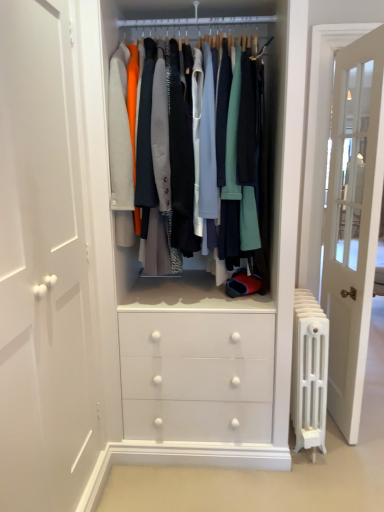
At what (x,y) coordinates should I click in order to perform the action: click on matte white clothes at center. Please return your answer as a coordinate pair (x, y). The height and width of the screenshot is (512, 384). Looking at the image, I should click on (203, 152).

This screenshot has height=512, width=384. Find the location of `white metal radiator at right`. white metal radiator at right is located at coordinates (309, 372).

Is white glass door at right spatially inside white metal radiator at right, or outside of it?

white glass door at right lies outside white metal radiator at right.

Looking at this image, is white glass door at right not near white metal radiator at right?

They are positioned close to each other.

Is white glass door at right wider or thinner than white metal radiator at right?

In the image, white glass door at right appears to be more narrow than white metal radiator at right.

Which is in front, point (257, 243) or point (344, 73)?

The point (257, 243) is in front.

Can you confirm if matte white clothes at center is positioned to the right of white glass door at right?

No, matte white clothes at center is not to the right of white glass door at right.

Which object is further away from the camera, matte white clothes at center or white glass door at right?

Positioned behind is white glass door at right.

Is matte white clothes at center looking in the opposite direction of white glass door at right?

matte white clothes at center does not have its back to white glass door at right.

Based on the photo, which of these two, matte white clothes at center or white metal radiator at right, stands shorter?

white metal radiator at right.

Would you consider matte white clothes at center to be distant from white metal radiator at right?

That's not correct — matte white clothes at center is a little close to white metal radiator at right.

How far apart are matte white clothes at center and white metal radiator at right?

76.49 centimeters.

From a real-world perspective, is matte white clothes at center over white metal radiator at right?

Indeed, from a real-world perspective, matte white clothes at center stands above white metal radiator at right.

Is white metal radiator at right completely or partially outside of white glass door at right?

Yes, white metal radiator at right is not within white glass door at right.

Which object is positioned more to the left, white metal radiator at right or white glass door at right?

white metal radiator at right.

Considering the points (320, 420) and (366, 142), which point is in front, point (320, 420) or point (366, 142)?

Point (320, 420)

Based on the photo, is white metal radiator at right facing away from white glass door at right?

No.

Consider the image. Can you see white metal radiator at right touching matte white clothes at center?

No, white metal radiator at right is not in contact with matte white clothes at center.

I want to click on closet above the white metal radiator at right (from a real-world perspective), so click(203, 152).

Consider the image. Does white metal radiator at right have a greater height compared to matte white clothes at center?

No, white metal radiator at right is not taller than matte white clothes at center.

From the image's perspective, which one is positioned higher, white glass door at right or matte white clothes at center?

matte white clothes at center, from the image's perspective.

Between white glass door at right and matte white clothes at center, which one has smaller width?

white glass door at right is thinner.

Is white glass door at right positioned beyond the bounds of matte white clothes at center?

white glass door at right is positioned outside matte white clothes at center.

Based on the photo, between white glass door at right and matte white clothes at center, which one appears on the left side from the viewer's perspective?

From the viewer's perspective, matte white clothes at center appears more on the left side.

At what (x,y) coordinates should I click in order to perform the action: click on door positioned vertically above the white metal radiator at right (from a real-world perspective). Please return your answer as a coordinate pair (x, y). Looking at the image, I should click on click(x=353, y=222).

Locate an element on the screen. Image resolution: width=384 pixels, height=512 pixels. door that appears below the matte white clothes at center (from the image's perspective) is located at coordinates (353, 222).

When comparing their distances from matte white clothes at center, does white metal radiator at right or white glass door at right seem further?

Based on the image, white glass door at right appears to be further to matte white clothes at center.

Which object lies nearer to the anchor point white glass door at right, white metal radiator at right or matte white clothes at center?

Among the two, white metal radiator at right is located nearer to white glass door at right.

When comparing their distances from white metal radiator at right, does matte white clothes at center or white glass door at right seem further?

matte white clothes at center is further to white metal radiator at right.

Looking at the image, which one is located closer to matte white clothes at center, white glass door at right or white metal radiator at right?

white metal radiator at right is closer to matte white clothes at center.

Which object lies further to the anchor point white glass door at right, matte white clothes at center or white metal radiator at right?

Among the two, matte white clothes at center is located further to white glass door at right.

Looking at the image, which one is located further to white metal radiator at right, white glass door at right or matte white clothes at center?

Based on the image, matte white clothes at center appears to be further to white metal radiator at right.

What are the coordinates of `door that lies between matte white clothes at center and white metal radiator at right from top to bottom` in the screenshot? It's located at (353, 222).